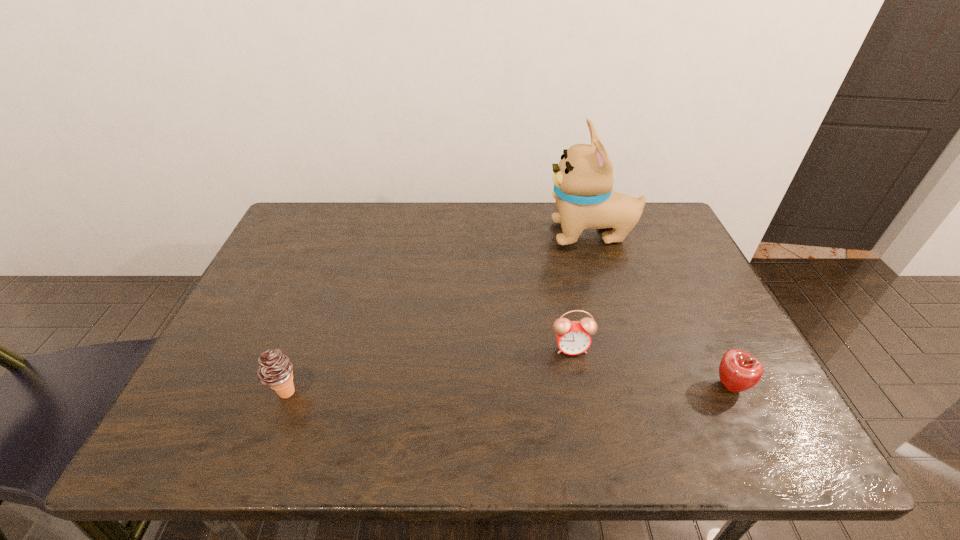
Locate an element on the screen. The image size is (960, 540). empty location between the tallest object and the icecream is located at coordinates (439, 313).

You are a GUI agent. You are given a task and a screenshot of the screen. Output one action in this format:
    pyautogui.click(x=<x>, y=<y>)
    Task: Click on the unoccupied area between the third nearest object and the tallest object
    The image size is (960, 540).
    Given the screenshot: What is the action you would take?
    pyautogui.click(x=581, y=291)

This screenshot has height=540, width=960. Identify the location of free spot between the farthest object and the third nearest object. (581, 291).

This screenshot has height=540, width=960. Identify the location of free space between the icecream and the third nearest object. (428, 370).

Where is `the closest object to the tallest object`? Image resolution: width=960 pixels, height=540 pixels. the closest object to the tallest object is located at coordinates (573, 338).

Identify which object is located as the third nearest to the second shortest object. Please provide its 2D coordinates. Your answer should be formatted as a tuple, i.e. [(x, y)], where the tuple contains the x and y coordinates of a point satisfying the conditions above.

[(275, 368)]

The height and width of the screenshot is (540, 960). In order to click on vacant space that satisfies the following two spatial constraints: 1. on the clock face of the rightmost object; 2. on the left side of the second shortest object in this screenshot , I will do `click(578, 387)`.

Identify the location of vacant region that satisfies the following two spatial constraints: 1. on the clock face of the apple; 2. on the left side of the second farthest object. (578, 387).

Identify the location of free spot that satisfies the following two spatial constraints: 1. on the face of the puppy; 2. on the clock face of the second shortest object. This screenshot has width=960, height=540. (627, 348).

Find the location of `vacant region that satisfies the following two spatial constraints: 1. on the face of the farthest object; 2. on the clock face of the alarm clock`. vacant region that satisfies the following two spatial constraints: 1. on the face of the farthest object; 2. on the clock face of the alarm clock is located at coordinates (627, 348).